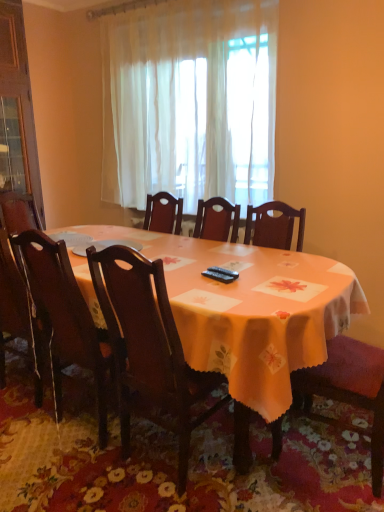
Locate an element on the screen. free space to the left of wooden chair at right, which is counted as the third chair, starting from the left is located at coordinates (262, 473).